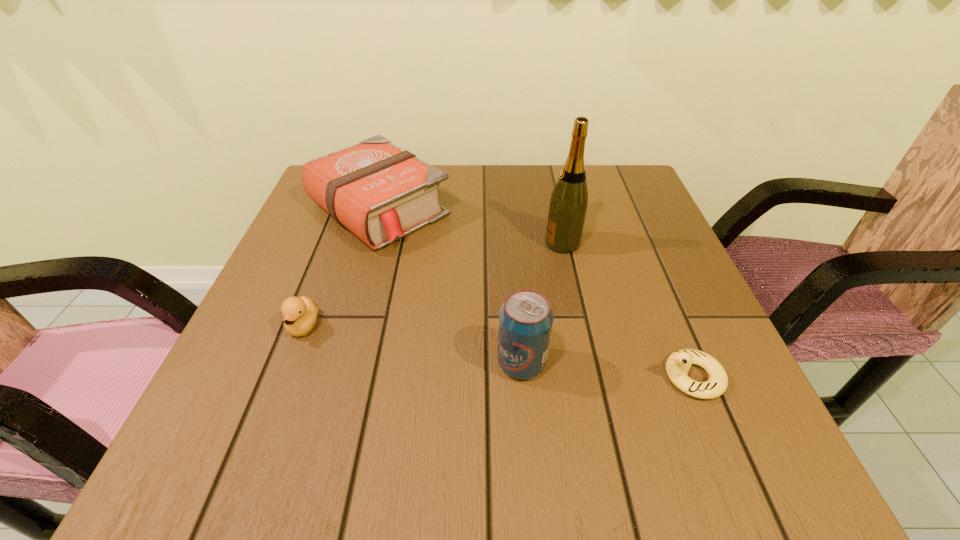
Identify the location of duckling located in the left edge section of the desktop. The height and width of the screenshot is (540, 960). (299, 314).

Where is `object located in the right edge section of the desktop`? The image size is (960, 540). object located in the right edge section of the desktop is located at coordinates (678, 364).

This screenshot has height=540, width=960. I want to click on object that is at the far left corner, so click(x=379, y=192).

Locate an element on the screen. The image size is (960, 540). vacant space at the far edge of the desktop is located at coordinates (486, 171).

Find the location of a particular element. This screenshot has height=540, width=960. free location at the near edge is located at coordinates (631, 428).

The height and width of the screenshot is (540, 960). I want to click on vacant point at the left edge, so click(x=295, y=251).

Locate an element on the screen. vacant space at the right edge is located at coordinates point(674,290).

At what (x,y) coordinates should I click in order to perform the action: click on free location at the far right corner. Please return your answer as a coordinate pair (x, y). Image resolution: width=960 pixels, height=540 pixels. Looking at the image, I should click on tap(601, 209).

At what (x,y) coordinates should I click in order to perform the action: click on unoccupied position between the nearer duckling and the third object from left to right. Please return your answer as a coordinate pair (x, y). This screenshot has height=540, width=960. Looking at the image, I should click on (607, 370).

Where is `free spot between the third nearest object and the fourth shortest object`? free spot between the third nearest object and the fourth shortest object is located at coordinates (413, 345).